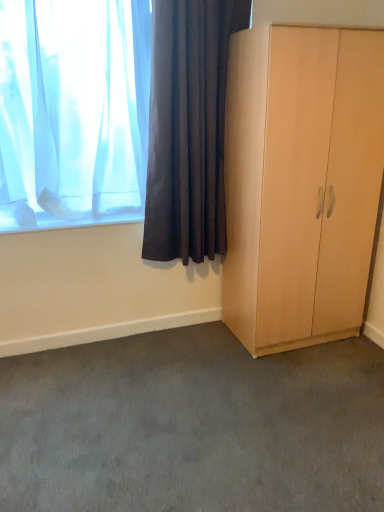
Image resolution: width=384 pixels, height=512 pixels. In order to click on free space below dark fabric curtain at upper left, the second curtain in the left-to-right sequence (from a real-world perspective) in this screenshot , I will do coord(193,328).